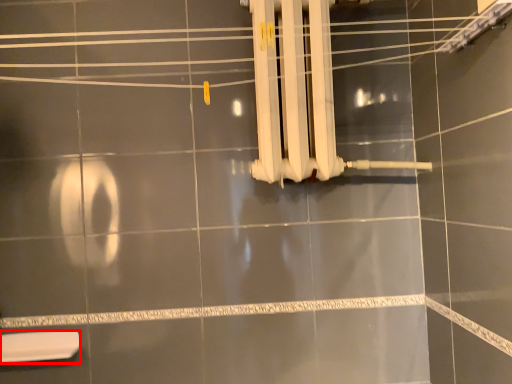
Question: From the image's perspective, where is toilet (annotated by the red box) located relative to shower?

Choices:
 (A) above
 (B) below

Answer: (B)